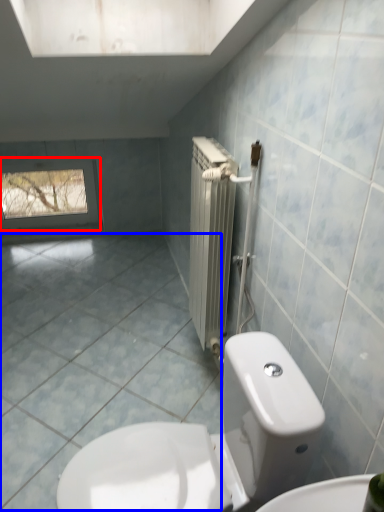
Question: Which object is further to the camera taking this photo, window (highlighted by a red box) or ceramic tile (highlighted by a blue box)?

Choices:
 (A) window
 (B) ceramic tile

Answer: (A)